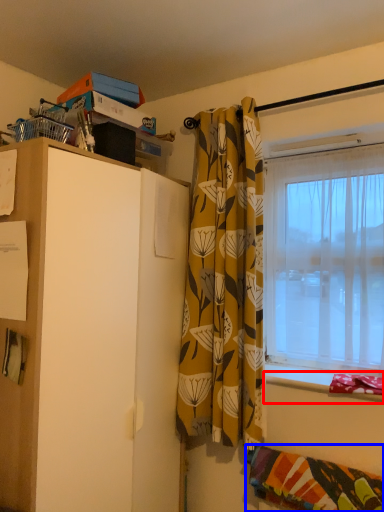
Question: Among these objects, which one is farthest to the camera, window sill (highlighted by a red box) or blanket (highlighted by a blue box)?

Choices:
 (A) window sill
 (B) blanket

Answer: (A)